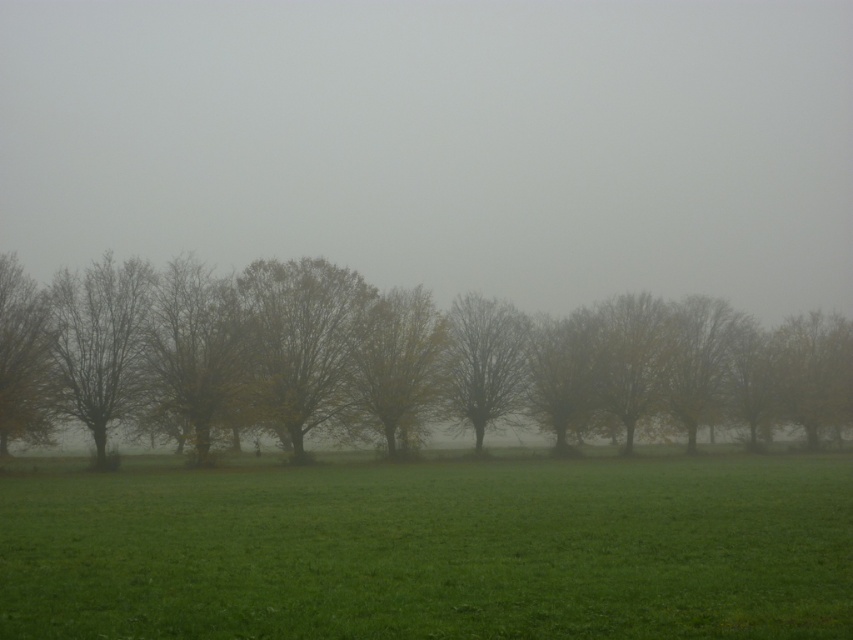
You are standing in the middle of a foggy field and see a point marked at coordinates [483,362]. What can you expect to find there?

The point at coordinates [483,362] indicates bare branches at center, so you can expect to find bare branches there.